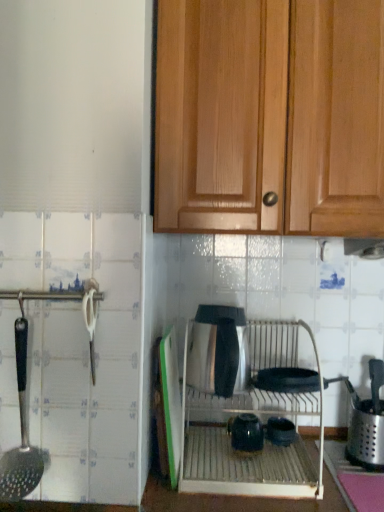
This screenshot has height=512, width=384. Find the location of `satin silver exhaust hood at upper center`. satin silver exhaust hood at upper center is located at coordinates (364, 248).

I want to click on stainless steel utensil holder at right, the first appliance from the right, so click(x=367, y=422).

Find the location of a particular element. This screenshot has width=384, height=512. green plastic cutting board at center is located at coordinates (171, 402).

Where is `wooden cabinet at upper center`? The height and width of the screenshot is (512, 384). wooden cabinet at upper center is located at coordinates (270, 117).

What do you see at coordinates (270, 117) in the screenshot? This screenshot has height=512, width=384. I see `wooden cabinet at upper center` at bounding box center [270, 117].

Image resolution: width=384 pixels, height=512 pixels. Describe the element at coordinates (246, 433) in the screenshot. I see `glossy ceramic tea pot at center` at that location.

Describe the element at coordinates (21, 434) in the screenshot. I see `black plastic slotted spoon at left` at that location.

What do you see at coordinates (280, 431) in the screenshot? I see `matte black kettle at center, placed as the 2th appliance when sorted from right to left` at bounding box center [280, 431].

Identify the location of satin silver exhaust hood at upper center. This screenshot has height=512, width=384. (364, 248).

Looking at the image, does satin silver oven at center seem bigger or smaller compared to stainless steel utensil holder at right, which is the 3th appliance from left to right?

satin silver oven at center is bigger than stainless steel utensil holder at right, which is the 3th appliance from left to right.

Is satin silver oven at center surrounding stainless steel utensil holder at right, which is the 3th appliance from left to right?

No.

In the image, is satin silver oven at center positioned in front of or behind stainless steel utensil holder at right, the first appliance from the right?

satin silver oven at center is positioned closer to the viewer than stainless steel utensil holder at right, the first appliance from the right.

Does point (293, 403) come farther from viewer compared to point (383, 416)?

That is False.

Based on the photo, considering the sizes of objects wooden cabinet at upper center and glossy ceramic tea pot at center in the image provided, who is shorter, wooden cabinet at upper center or glossy ceramic tea pot at center?

glossy ceramic tea pot at center is shorter.

Can you confirm if wooden cabinet at upper center is positioned to the right of glossy ceramic tea pot at center?

Correct, you'll find wooden cabinet at upper center to the right of glossy ceramic tea pot at center.

How far apart are wooden cabinet at upper center and glossy ceramic tea pot at center?

wooden cabinet at upper center and glossy ceramic tea pot at center are 29.16 inches apart.

Between wooden cabinet at upper center and glossy ceramic tea pot at center, which one is positioned behind?

glossy ceramic tea pot at center is further from the camera.

Is black plastic slotted spoon at left far from green plastic cutting board at center?

Actually, black plastic slotted spoon at left and green plastic cutting board at center are a little close together.

From a real-world perspective, is black plastic slotted spoon at left physically located above or below green plastic cutting board at center?

Clearly, from a real-world perspective, black plastic slotted spoon at left is above green plastic cutting board at center.

Relative to green plastic cutting board at center, is black plastic slotted spoon at left in front or behind?

In the image, black plastic slotted spoon at left appears in front of green plastic cutting board at center.

Is glossy ceramic tea pot at center outside of black plastic slotted spoon at left?

glossy ceramic tea pot at center is positioned outside black plastic slotted spoon at left.

Does glossy ceramic tea pot at center turn towards black plastic slotted spoon at left?

No.

From a real-world perspective, is glossy ceramic tea pot at center physically below black plastic slotted spoon at left?

Yes, from a real-world perspective, glossy ceramic tea pot at center is beneath black plastic slotted spoon at left.

Does glossy ceramic tea pot at center have a greater width compared to black plastic slotted spoon at left?

Indeed, glossy ceramic tea pot at center has a greater width compared to black plastic slotted spoon at left.

Between wooden cabinet at upper center and green plastic cutting board at center, which one has more height?

With more height is wooden cabinet at upper center.

Is wooden cabinet at upper center directly adjacent to green plastic cutting board at center?

wooden cabinet at upper center and green plastic cutting board at center are clearly separated.

Is wooden cabinet at upper center positioned with its back to green plastic cutting board at center?

wooden cabinet at upper center is not turned away from green plastic cutting board at center.

Considering the relative positions of wooden cabinet at upper center and green plastic cutting board at center in the image provided, is wooden cabinet at upper center to the right of green plastic cutting board at center from the viewer's perspective?

Correct, you'll find wooden cabinet at upper center to the right of green plastic cutting board at center.

Which is further, [232,444] or [350,114]?

Positioned behind is point [232,444].

Is glossy ceramic tea pot at center directly adjacent to wooden cabinet at upper center?

No.

Is the position of glossy ceramic tea pot at center more distant than that of wooden cabinet at upper center?

That is True.

From a real-world perspective, between black plastic slotted spoon at left and satin silver kettle at center, the first appliance from the left, who is vertically higher?

satin silver kettle at center, the first appliance from the left, is physically above.

Considering the sizes of objects black plastic slotted spoon at left and satin silver kettle at center, the 3th appliance when ordered from right to left, in the image provided, who is thinner, black plastic slotted spoon at left or satin silver kettle at center, the 3th appliance when ordered from right to left,?

black plastic slotted spoon at left is thinner.

From the image's perspective, between black plastic slotted spoon at left and satin silver kettle at center, the first appliance from the left, who is located below?

black plastic slotted spoon at left.

Is black plastic slotted spoon at left facing towards satin silver kettle at center, the first appliance from the left?

No.

I want to click on oven above the stainless steel utensil holder at right, the first appliance from the right (from a real-world perspective), so click(x=261, y=420).

Where is `cabinetry lying in front of the glossy ceramic tea pot at center`? The width and height of the screenshot is (384, 512). cabinetry lying in front of the glossy ceramic tea pot at center is located at coordinates (270, 117).

Based on their spatial positions, is satin silver oven at center or glossy ceramic tea pot at center further from black plastic slotted spoon at left?

Based on the image, glossy ceramic tea pot at center appears to be further to black plastic slotted spoon at left.

Based on their spatial positions, is wooden cabinet at upper center or satin silver kettle at center, the first appliance from the left, closer to satin silver exhaust hood at upper center?

satin silver kettle at center, the first appliance from the left.

Estimate the real-world distances between objects in this image. Which object is further from glossy ceramic tea pot at center, black plastic slotted spoon at left or wooden cabinet at upper center?

wooden cabinet at upper center.

Based on their spatial positions, is green plastic cutting board at center or satin silver oven at center closer to satin silver exhaust hood at upper center?

The object closer to satin silver exhaust hood at upper center is satin silver oven at center.

Which object lies nearer to the anchor point satin silver oven at center, black plastic slotted spoon at left or glossy ceramic tea pot at center?

glossy ceramic tea pot at center.

Which object lies further to the anchor point matte black kettle at center, placed as the 2th appliance when sorted from right to left, wooden cabinet at upper center or satin silver exhaust hood at upper center?

wooden cabinet at upper center lies further to matte black kettle at center, placed as the 2th appliance when sorted from right to left, than the other object.

From the image, which object appears to be nearer to satin silver kettle at center, the 3th appliance when ordered from right to left, satin silver exhaust hood at upper center or stainless steel utensil holder at right, the first appliance from the right?

Among the two, stainless steel utensil holder at right, the first appliance from the right, is located nearer to satin silver kettle at center, the 3th appliance when ordered from right to left.

Which object lies further to the anchor point wooden cabinet at upper center, matte black kettle at center, which ranks as the 2th appliance in left-to-right order, or stainless steel utensil holder at right, the first appliance from the right?

matte black kettle at center, which ranks as the 2th appliance in left-to-right order.

Find the location of a particular element. Image resolution: width=384 pixels, height=512 pixels. exhaust hood between wooden cabinet at upper center and matte black kettle at center, which ranks as the 2th appliance in left-to-right order, in the vertical direction is located at coordinates (364, 248).

Where is `screen door located between black plastic slotted spoon at left and matte black kettle at center, which ranks as the 2th appliance in left-to-right order, in the left-right direction`? The width and height of the screenshot is (384, 512). screen door located between black plastic slotted spoon at left and matte black kettle at center, which ranks as the 2th appliance in left-to-right order, in the left-right direction is located at coordinates (171, 402).

You are a GUI agent. You are given a task and a screenshot of the screen. Output one action in this format:
    pyautogui.click(x=<x>, y=<y>)
    Task: Click on the exhaust hood between wooden cabinet at upper center and glossy ceramic tea pot at center in the up-down direction
    The width and height of the screenshot is (384, 512).
    Given the screenshot: What is the action you would take?
    pyautogui.click(x=364, y=248)

The image size is (384, 512). Find the location of `oven between wooden cabinet at upper center and green plastic cutting board at center in the vertical direction`. oven between wooden cabinet at upper center and green plastic cutting board at center in the vertical direction is located at coordinates (261, 420).